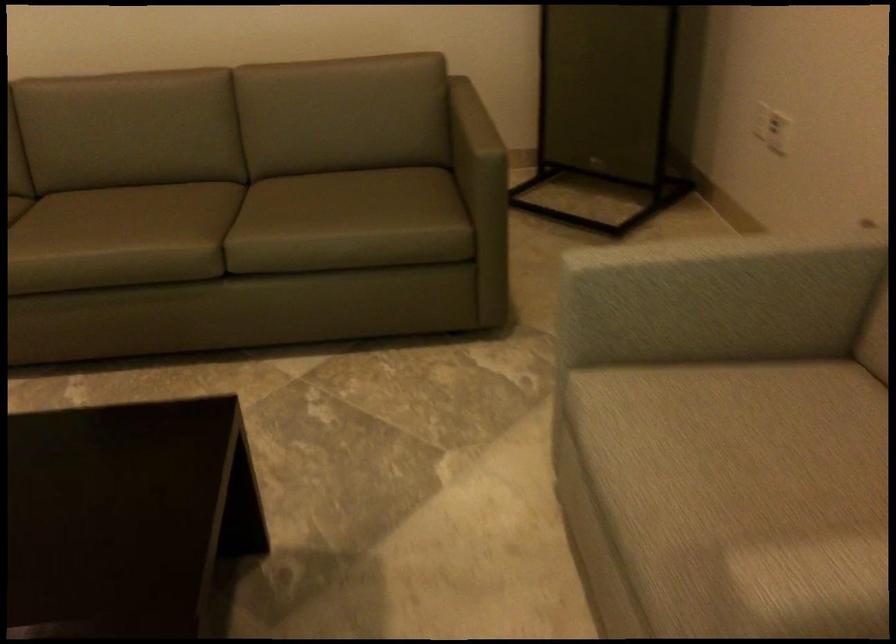
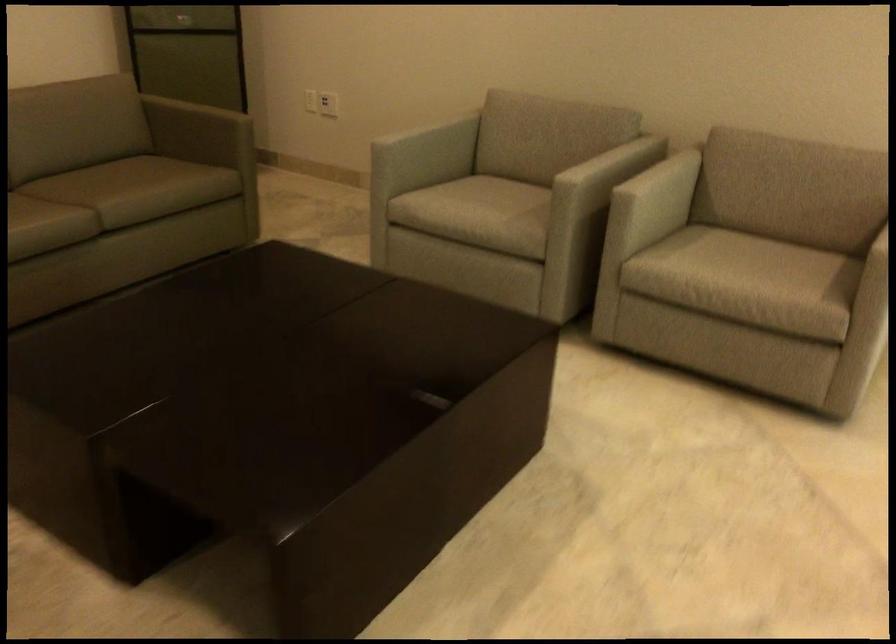
The point at (765, 153) is marked in the first image. Where is the corresponding point in the second image?

(328, 104)